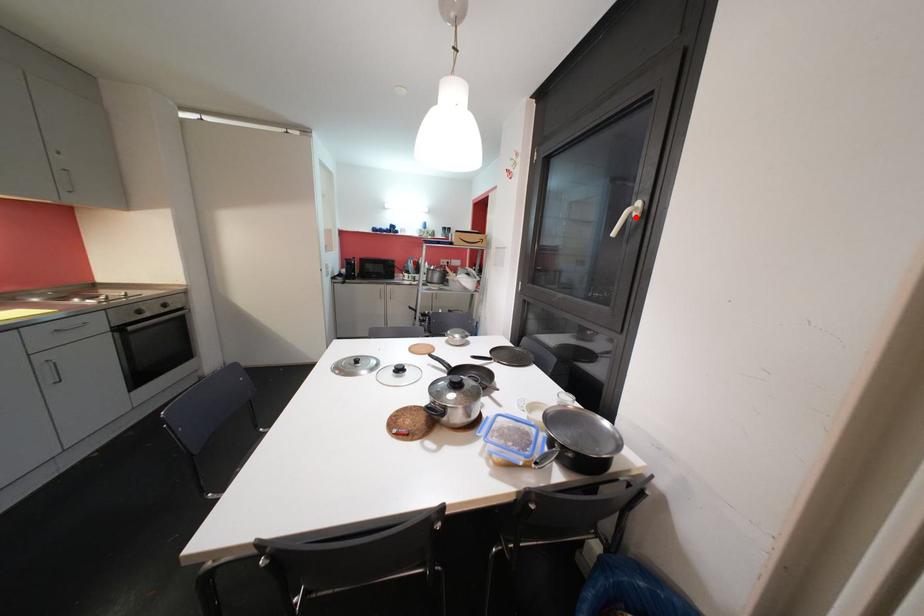
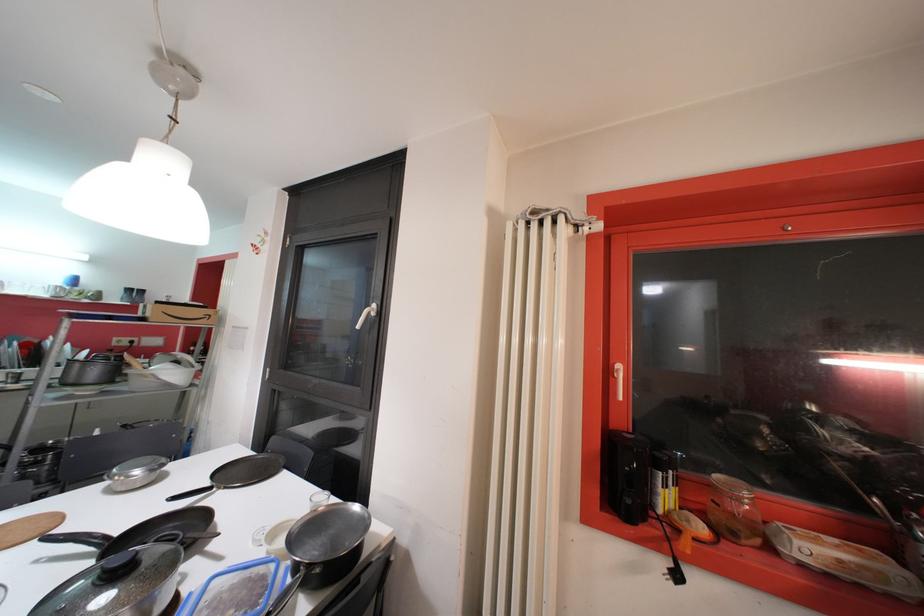
The point at the highlighted location is marked in the first image. Where is the corresponding point in the second image?

(373, 315)